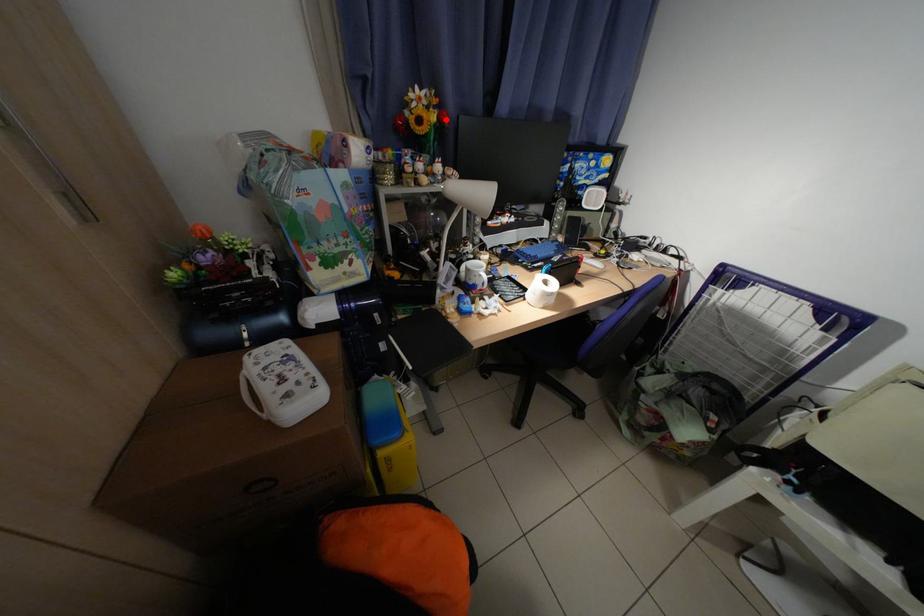
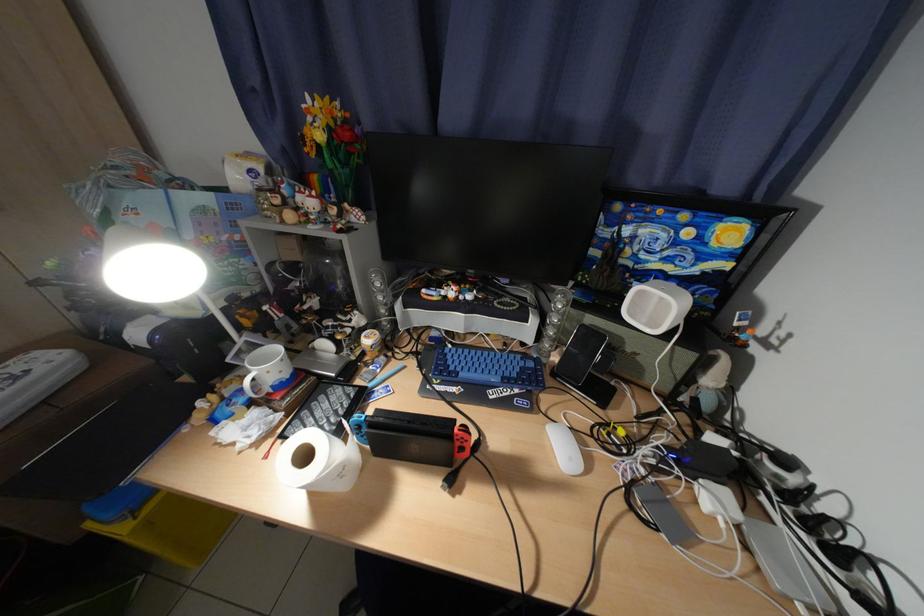
Find the pixel in the second image that matches the highlighted location in the first image.

(331, 138)